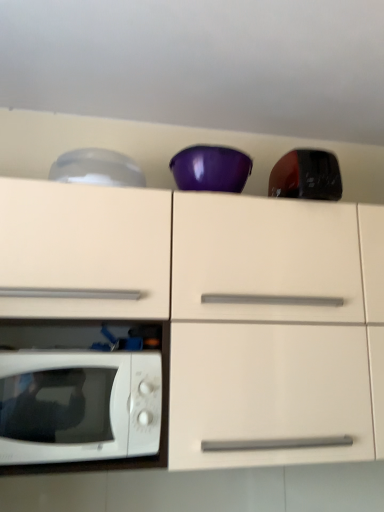
Locate an element on the screen. This screenshot has width=384, height=512. white glossy microwave oven at lower left is located at coordinates (78, 406).

Describe the element at coordinates (78, 406) in the screenshot. I see `white glossy microwave oven at lower left` at that location.

Locate an element on the screen. Image resolution: width=384 pixels, height=512 pixels. transparent plastic bowl at upper left, positioned as the 1th appliance in left-to-right order is located at coordinates (97, 168).

The width and height of the screenshot is (384, 512). Describe the element at coordinates (97, 168) in the screenshot. I see `transparent plastic bowl at upper left, the 2th appliance viewed from the right` at that location.

Identify the location of white glossy cabinet at center. (195, 324).

Based on the photo, between transparent plastic bowl at upper left, positioned as the 1th appliance in left-to-right order, and white glossy cabinet at center, which one has more height?

Standing taller between the two is white glossy cabinet at center.

Is transparent plastic bowl at upper left, positioned as the 1th appliance in left-to-right order, behind white glossy cabinet at center?

That is True.

Considering the positions of objects transparent plastic bowl at upper left, the 2th appliance viewed from the right, and white glossy cabinet at center in the image provided, who is more to the left, transparent plastic bowl at upper left, the 2th appliance viewed from the right, or white glossy cabinet at center?

Positioned to the left is transparent plastic bowl at upper left, the 2th appliance viewed from the right.

Considering the points (102, 176) and (67, 336), which point is behind, point (102, 176) or point (67, 336)?

The point (67, 336) is behind.

Is point (149, 437) positioned behind point (284, 166)?

No, (149, 437) is in front of (284, 166).

Is white glossy microwave oven at lower left aimed at glossy black toaster at upper right, arranged as the first appliance when viewed from the right?

No, white glossy microwave oven at lower left is not turned towards glossy black toaster at upper right, arranged as the first appliance when viewed from the right.

From the image's perspective, is white glossy microwave oven at lower left located above or below glossy black toaster at upper right, arranged as the first appliance when viewed from the right?

Based on their image positions, white glossy microwave oven at lower left is located beneath glossy black toaster at upper right, arranged as the first appliance when viewed from the right.

Considering the positions of objects white glossy microwave oven at lower left and glossy black toaster at upper right, arranged as the first appliance when viewed from the right, in the image provided, who is in front, white glossy microwave oven at lower left or glossy black toaster at upper right, arranged as the first appliance when viewed from the right,?

white glossy microwave oven at lower left.

Considering the relative sizes of white glossy microwave oven at lower left and white glossy cabinet at center in the image provided, is white glossy microwave oven at lower left taller than white glossy cabinet at center?

No.

Considering the relative sizes of white glossy microwave oven at lower left and white glossy cabinet at center in the image provided, is white glossy microwave oven at lower left smaller than white glossy cabinet at center?

Indeed, white glossy microwave oven at lower left has a smaller size compared to white glossy cabinet at center.

Based on their positions, is white glossy microwave oven at lower left located to the left or right of white glossy cabinet at center?

Clearly, white glossy microwave oven at lower left is on the left of white glossy cabinet at center in the image.

How far apart are white glossy microwave oven at lower left and white glossy cabinet at center?

white glossy microwave oven at lower left and white glossy cabinet at center are 6.66 inches apart from each other.

From a real-world perspective, which appliance is the 2nd one above the white glossy cabinet at center? Please provide its 2D coordinates.

[(97, 168)]

In the scene shown: Between white glossy cabinet at center and transparent plastic bowl at upper left, the 2th appliance viewed from the right, which one appears on the right side from the viewer's perspective?

white glossy cabinet at center is more to the right.

Which object is thinner, white glossy cabinet at center or transparent plastic bowl at upper left, positioned as the 1th appliance in left-to-right order?

Thinner between the two is transparent plastic bowl at upper left, positioned as the 1th appliance in left-to-right order.

Does point (320, 364) lie in front of point (90, 152)?

Yes.

Considering the sizes of objects white glossy cabinet at center and glossy black toaster at upper right, arranged as the first appliance when viewed from the right, in the image provided, who is shorter, white glossy cabinet at center or glossy black toaster at upper right, arranged as the first appliance when viewed from the right,?

glossy black toaster at upper right, arranged as the first appliance when viewed from the right, is shorter.

Locate an element on the screen. The width and height of the screenshot is (384, 512). appliance that is on the right side of white glossy cabinet at center is located at coordinates (306, 176).

Consider the image. Is white glossy cabinet at center oriented away from glossy black toaster at upper right, arranged as the first appliance when viewed from the right?

No.

Considering the relative positions of white glossy cabinet at center and glossy black toaster at upper right, arranged as the 2th appliance when viewed from the left, in the image provided, is white glossy cabinet at center to the left or to the right of glossy black toaster at upper right, arranged as the 2th appliance when viewed from the left,?

In the image, white glossy cabinet at center appears on the left side of glossy black toaster at upper right, arranged as the 2th appliance when viewed from the left.

Who is smaller, white glossy cabinet at center or white glossy microwave oven at lower left?

white glossy microwave oven at lower left is smaller.

Would you consider white glossy cabinet at center to be distant from white glossy microwave oven at lower left?

white glossy cabinet at center is actually quite close to white glossy microwave oven at lower left.

Between point (111, 411) and point (75, 439), which one is positioned behind?

The point (111, 411) is farther.

Relative to glossy black toaster at upper right, arranged as the first appliance when viewed from the right, is transparent plastic bowl at upper left, positioned as the 1th appliance in left-to-right order, in front or behind?

Clearly, transparent plastic bowl at upper left, positioned as the 1th appliance in left-to-right order, is behind glossy black toaster at upper right, arranged as the first appliance when viewed from the right.

Is transparent plastic bowl at upper left, the 2th appliance viewed from the right, positioned beyond the bounds of glossy black toaster at upper right, arranged as the first appliance when viewed from the right?

Yes.

Is transparent plastic bowl at upper left, positioned as the 1th appliance in left-to-right order, shorter than glossy black toaster at upper right, arranged as the 2th appliance when viewed from the left?

Yes.

From a real-world perspective, which object rests below the other?

In real-world perspective, glossy black toaster at upper right, arranged as the 2th appliance when viewed from the left, is lower.

In order to click on cabinetry below the transparent plastic bowl at upper left, positioned as the 1th appliance in left-to-right order (from the image's perspective) in this screenshot , I will do `click(195, 324)`.

Where is `microwave oven in front of the glossy black toaster at upper right, arranged as the 2th appliance when viewed from the left`? microwave oven in front of the glossy black toaster at upper right, arranged as the 2th appliance when viewed from the left is located at coordinates (78, 406).

Estimate the real-world distances between objects in this image. Which object is further from glossy black toaster at upper right, arranged as the first appliance when viewed from the right, white glossy cabinet at center or white glossy microwave oven at lower left?

white glossy microwave oven at lower left lies further to glossy black toaster at upper right, arranged as the first appliance when viewed from the right, than the other object.

Based on their spatial positions, is white glossy microwave oven at lower left or transparent plastic bowl at upper left, positioned as the 1th appliance in left-to-right order, further from glossy black toaster at upper right, arranged as the first appliance when viewed from the right?

white glossy microwave oven at lower left lies further to glossy black toaster at upper right, arranged as the first appliance when viewed from the right, than the other object.

Estimate the real-world distances between objects in this image. Which object is further from transparent plastic bowl at upper left, the 2th appliance viewed from the right, white glossy cabinet at center or glossy black toaster at upper right, arranged as the first appliance when viewed from the right?

glossy black toaster at upper right, arranged as the first appliance when viewed from the right, lies further to transparent plastic bowl at upper left, the 2th appliance viewed from the right, than the other object.

Based on the photo, when comparing their distances from white glossy microwave oven at lower left, does glossy black toaster at upper right, arranged as the 2th appliance when viewed from the left, or transparent plastic bowl at upper left, positioned as the 1th appliance in left-to-right order, seem closer?

transparent plastic bowl at upper left, positioned as the 1th appliance in left-to-right order, is positioned closer to the anchor white glossy microwave oven at lower left.

When comparing their distances from white glossy cabinet at center, does transparent plastic bowl at upper left, the 2th appliance viewed from the right, or white glossy microwave oven at lower left seem further?

Based on the image, transparent plastic bowl at upper left, the 2th appliance viewed from the right, appears to be further to white glossy cabinet at center.

Estimate the real-world distances between objects in this image. Which object is closer to white glossy cabinet at center, glossy black toaster at upper right, arranged as the first appliance when viewed from the right, or white glossy microwave oven at lower left?

white glossy microwave oven at lower left is closer to white glossy cabinet at center.

Looking at the image, which one is located closer to white glossy microwave oven at lower left, glossy black toaster at upper right, arranged as the 2th appliance when viewed from the left, or white glossy cabinet at center?

Among the two, white glossy cabinet at center is located nearer to white glossy microwave oven at lower left.

Based on their spatial positions, is transparent plastic bowl at upper left, positioned as the 1th appliance in left-to-right order, or white glossy microwave oven at lower left further from glossy black toaster at upper right, arranged as the first appliance when viewed from the right?

white glossy microwave oven at lower left is positioned further to the anchor glossy black toaster at upper right, arranged as the first appliance when viewed from the right.

I want to click on appliance located between white glossy microwave oven at lower left and glossy black toaster at upper right, arranged as the first appliance when viewed from the right, in the left-right direction, so 97,168.

Find the location of a particular element. cabinetry between transparent plastic bowl at upper left, the 2th appliance viewed from the right, and white glossy microwave oven at lower left, in the vertical direction is located at coordinates (195, 324).

Identify the location of cabinetry located between transparent plastic bowl at upper left, the 2th appliance viewed from the right, and glossy black toaster at upper right, arranged as the 2th appliance when viewed from the left, in the left-right direction. (195, 324).

I want to click on cabinetry between white glossy microwave oven at lower left and glossy black toaster at upper right, arranged as the 2th appliance when viewed from the left, in the horizontal direction, so (195, 324).